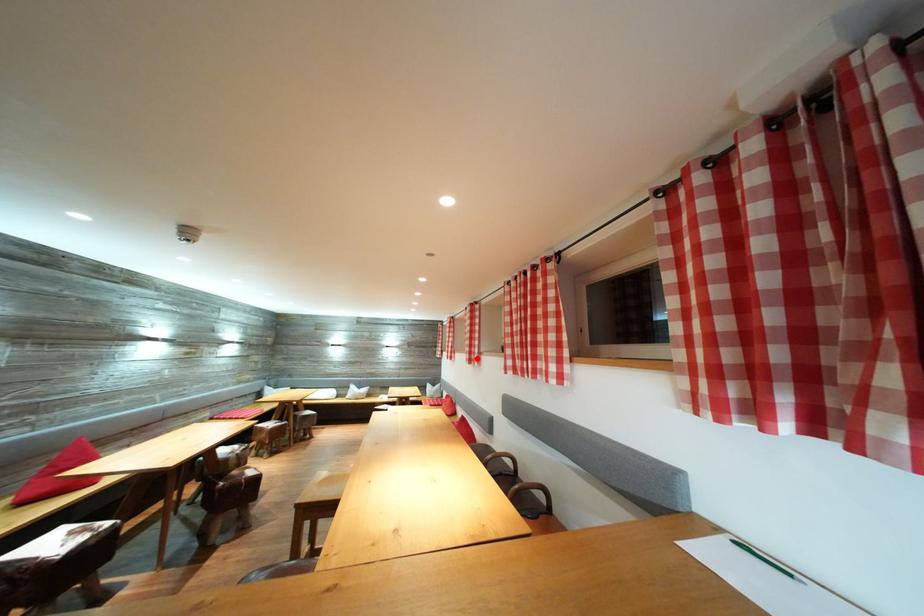
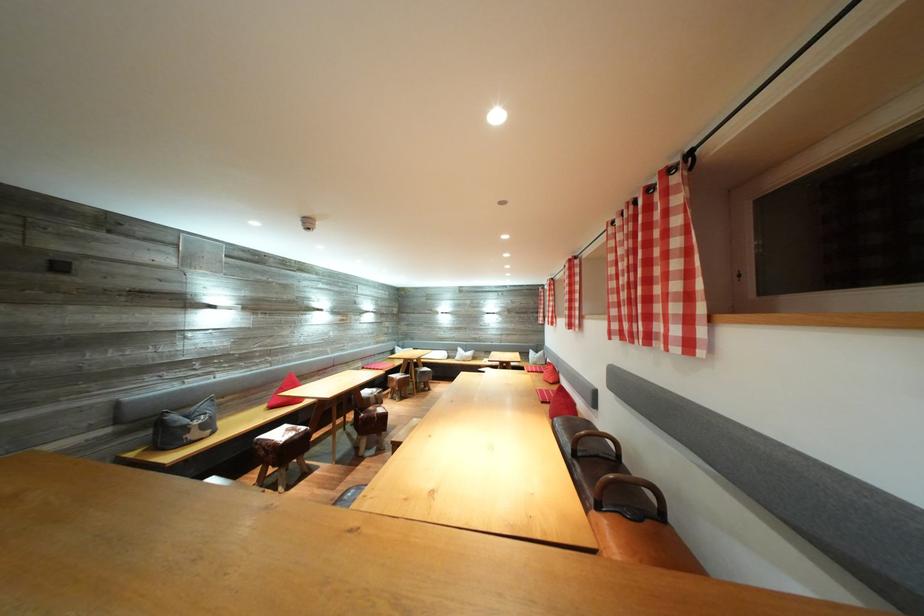
Locate, in the second image, the point that corresponds to the highlighted location in the first image.

(578, 322)